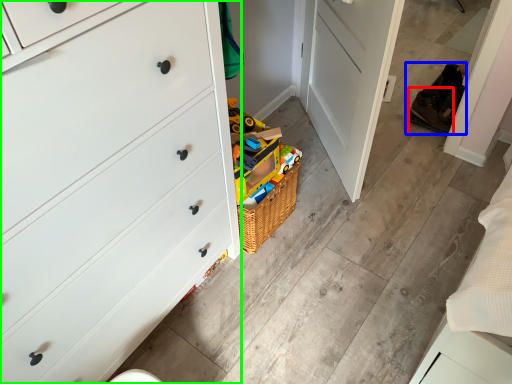
Question: Considering the real-world distances, which object is closest to shoe (highlighted by a red box)? shoe (highlighted by a blue box) or chest of drawers (highlighted by a green box).

Choices:
 (A) shoe
 (B) chest of drawers

Answer: (A)